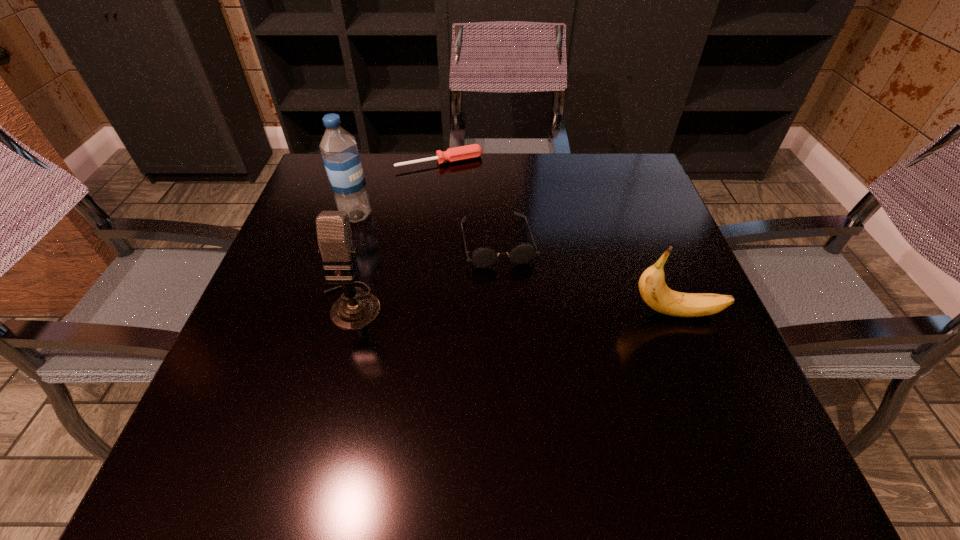
Locate an element on the screen. free spot on the desktop that is between the microphone and the rightmost object and is positioned at the tip of the screwdriver is located at coordinates (516, 309).

The width and height of the screenshot is (960, 540). I want to click on vacant space on the desktop that is between the microphone and the third shortest object and is positioned on the label of the water bottle, so click(519, 309).

The height and width of the screenshot is (540, 960). I want to click on vacant spot on the desktop that is between the microphone and the banana and is positioned on the front-facing side of the fourth tallest object, so click(x=516, y=309).